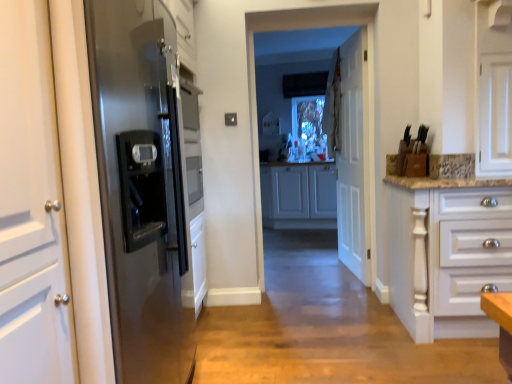
Question: Can you confirm if white matte cabinet at center, acting as the 2th cabinetry starting from the front, is shorter than clear glass window at center?

Choices:
 (A) yes
 (B) no

Answer: (A)

Question: Considering the relative positions of white matte cabinet at center, which ranks as the 1th cabinetry in back-to-front order, and clear glass window at center in the image provided, is white matte cabinet at center, which ranks as the 1th cabinetry in back-to-front order, to the left of clear glass window at center from the viewer's perspective?

Choices:
 (A) no
 (B) yes

Answer: (A)

Question: Are white matte cabinet at center, which ranks as the 1th cabinetry in back-to-front order, and clear glass window at center making contact?

Choices:
 (A) yes
 (B) no

Answer: (A)

Question: Could you tell me if white matte cabinet at center, which ranks as the 1th cabinetry in back-to-front order, is facing clear glass window at center?

Choices:
 (A) yes
 (B) no

Answer: (A)

Question: Is white matte cabinet at center, acting as the 2th cabinetry starting from the front, taller than clear glass window at center?

Choices:
 (A) yes
 (B) no

Answer: (B)

Question: Is white wooden door at center in front of or behind white sheer curtain at upper center in the image?

Choices:
 (A) behind
 (B) front

Answer: (B)

Question: Considering the positions of white wooden door at center and white sheer curtain at upper center in the image, is white wooden door at center bigger or smaller than white sheer curtain at upper center?

Choices:
 (A) small
 (B) big

Answer: (B)

Question: Would you say white wooden door at center is to the left or to the right of white sheer curtain at upper center in the picture?

Choices:
 (A) left
 (B) right

Answer: (B)

Question: From the image's perspective, is white wooden door at center above or below white sheer curtain at upper center?

Choices:
 (A) below
 (B) above

Answer: (A)

Question: In terms of height, does clear glass window at center look taller or shorter compared to white matte cabinet at center, which ranks as the 1th cabinetry in back-to-front order?

Choices:
 (A) short
 (B) tall

Answer: (B)

Question: In terms of width, does clear glass window at center look wider or thinner when compared to white matte cabinet at center, which ranks as the 1th cabinetry in back-to-front order?

Choices:
 (A) thin
 (B) wide

Answer: (A)

Question: In the image, is clear glass window at center positioned in front of or behind white matte cabinet at center, which ranks as the 1th cabinetry in back-to-front order?

Choices:
 (A) front
 (B) behind

Answer: (A)

Question: Choose the correct answer: Is clear glass window at center inside white matte cabinet at center, acting as the 2th cabinetry starting from the front, or outside it?

Choices:
 (A) outside
 (B) inside

Answer: (A)

Question: Considering the positions of white sheer curtain at upper center and white matte cabinet at center, acting as the 2th cabinetry starting from the front, in the image, is white sheer curtain at upper center taller or shorter than white matte cabinet at center, acting as the 2th cabinetry starting from the front,?

Choices:
 (A) tall
 (B) short

Answer: (A)

Question: From a real-world perspective, is white sheer curtain at upper center above or below white matte cabinet at center, acting as the 2th cabinetry starting from the front?

Choices:
 (A) below
 (B) above

Answer: (B)